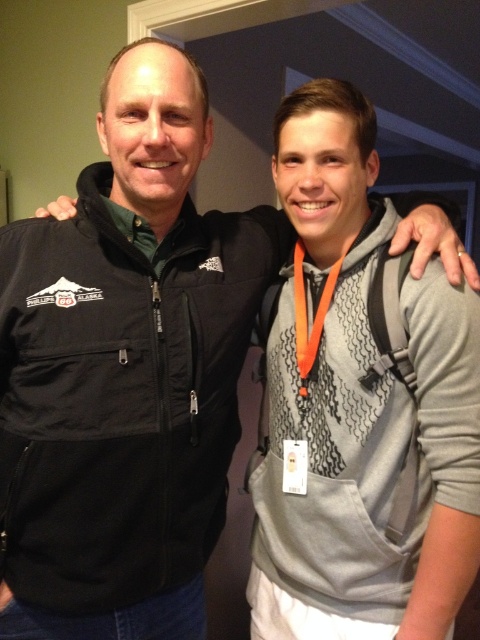
You are a photographer setting up for a group photo. You notice the green fabric at center and the orange lanyard at center in the scene. Which object is wider?

The green fabric at center is wider than the orange lanyard at center as its width surpasses the orange lanyard at center.

Based on the photo, you are a photographer setting up a portrait shoot in a room with dark blue walls. You have two subjects wearing a black softshell jacket at center and an orange lanyard at center. You want to ensure the jacket is visible against the background. Which item should you focus on to avoid it blending into the dark blue walls?

The black softshell jacket at center might be wider than orange lanyard at center, so focusing on the black softshell jacket at center would be better to ensure visibility against the dark blue walls since its larger size makes it stand out more.